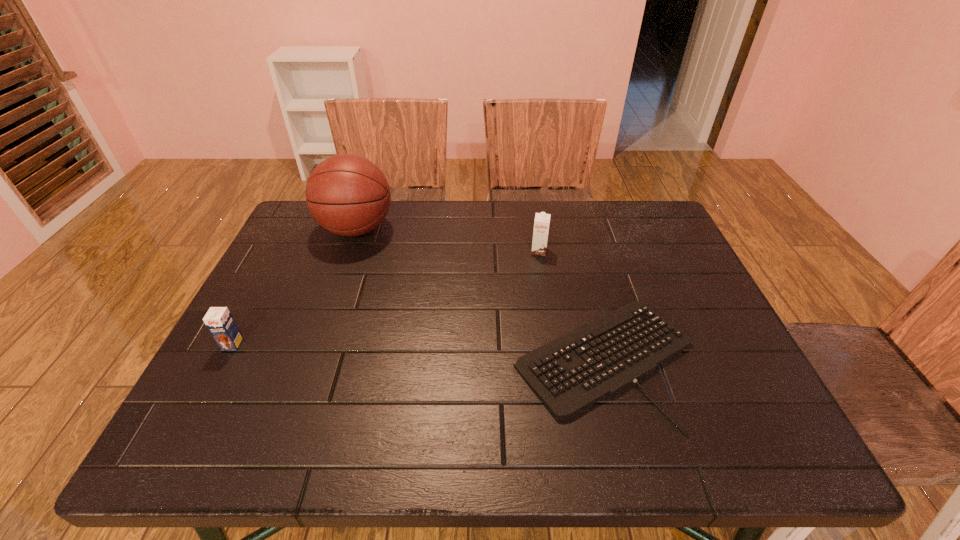
Where is `basketball located at the far edge`? The image size is (960, 540). basketball located at the far edge is located at coordinates (348, 195).

Locate an element on the screen. This screenshot has height=540, width=960. chocolate milk at the far edge is located at coordinates (541, 224).

Where is `object located in the near edge section of the desktop`? Image resolution: width=960 pixels, height=540 pixels. object located in the near edge section of the desktop is located at coordinates (569, 374).

Where is `basketball situated at the left edge`? This screenshot has width=960, height=540. basketball situated at the left edge is located at coordinates pos(348,195).

At what (x,y) coordinates should I click in order to perform the action: click on chocolate milk that is at the left edge. Please return your answer as a coordinate pair (x, y). Image resolution: width=960 pixels, height=540 pixels. Looking at the image, I should click on [219, 321].

You are a GUI agent. You are given a task and a screenshot of the screen. Output one action in this format:
    pyautogui.click(x=<x>, y=<y>)
    Task: Click on the object positioned at the right edge
    Image resolution: width=960 pixels, height=540 pixels.
    Given the screenshot: What is the action you would take?
    (569, 374)

The width and height of the screenshot is (960, 540). I want to click on object that is at the far left corner, so click(x=348, y=195).

The width and height of the screenshot is (960, 540). In order to click on object located at the near right corner in this screenshot , I will do `click(569, 374)`.

This screenshot has width=960, height=540. In the image, there is a desktop. Identify the location of free space at the far edge. (424, 214).

This screenshot has width=960, height=540. Find the location of `blank space at the near edge of the desktop`. blank space at the near edge of the desktop is located at coordinates (648, 434).